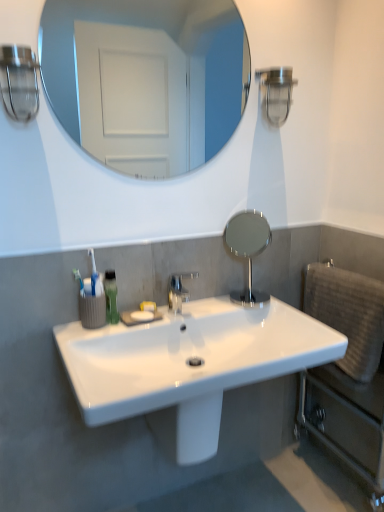
This screenshot has height=512, width=384. What are the coordinates of `free point behind polished chrome faucet at center` in the screenshot? It's located at (201, 304).